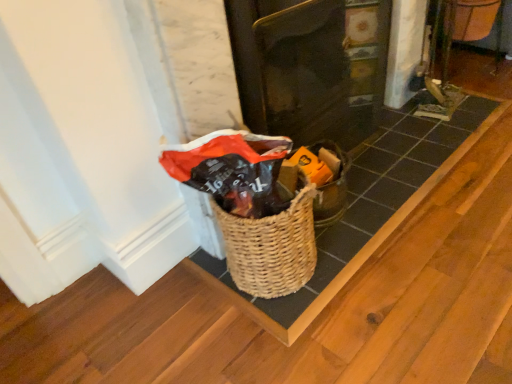
Measure the distance between point (404,190) and camera.

Point (404,190) is 5.34 feet away from camera.

The image size is (512, 384). I want to click on matte black door at center, so click(311, 66).

From the image's perspective, would you say woven brown basket at center is positioned over woven wood basket at center?

No, from the image's perspective, woven brown basket at center is not over woven wood basket at center.

Considering the relative sizes of woven brown basket at center and woven wood basket at center in the image provided, is woven brown basket at center taller than woven wood basket at center?

Correct, woven brown basket at center is much taller as woven wood basket at center.

Is woven brown basket at center facing away from woven wood basket at center?

No, woven brown basket at center is not facing away from woven wood basket at center.

Between woven brown basket at center and woven wood basket at center, which one has larger size?

woven brown basket at center.

From the image's perspective, between woven wood basket at center and woven brown basket at center, who is located below?

woven brown basket at center appears lower in the image.

Which is correct: woven wood basket at center is inside woven brown basket at center, or outside of it?

woven wood basket at center cannot be found inside woven brown basket at center.

Where is `basket lying below the woven wood basket at center (from the image's perspective)`? This screenshot has height=384, width=512. basket lying below the woven wood basket at center (from the image's perspective) is located at coordinates (272, 246).

From the picture: Which object is positioned more to the left, woven wood basket at center or woven brown basket at center?

From the viewer's perspective, woven brown basket at center appears more on the left side.

Does matte black door at center have a greater width compared to woven wood basket at center?

No.

Does point (360, 25) appear closer or farther from the camera than point (224, 283)?

Point (360, 25).

How many degrees apart are the facing directions of matte black door at center and woven wood basket at center?

The facing directions of matte black door at center and woven wood basket at center are 0.00194 degrees apart.

Which object is more forward, matte black door at center or woven wood basket at center?

matte black door at center is more forward.

At what (x,y) coordinates should I click in order to perform the action: click on basket located in front of the matte black door at center. Please return your answer as a coordinate pair (x, y). Looking at the image, I should click on (272, 246).

Can you confirm if matte black door at center is bigger than woven brown basket at center?

Yes, matte black door at center is bigger than woven brown basket at center.

Based on the photo, from the image's perspective, is matte black door at center above or below woven brown basket at center?

Clearly, from the image's perspective, matte black door at center is above woven brown basket at center.

Is point (330, 228) positioned after point (330, 113)?

No.

Is woven wood basket at center turned away from matte black door at center?

Yes.

You are a GUI agent. You are given a task and a screenshot of the screen. Output one action in this format:
    pyautogui.click(x=<x>, y=<y>)
    Task: Click on the door above the woven wood basket at center (from the image's perspective)
    This screenshot has height=384, width=512.
    Given the screenshot: What is the action you would take?
    pyautogui.click(x=311, y=66)

Which object is closer to the camera, woven wood basket at center or matte black door at center?

matte black door at center.

In the scene shown: From a real-world perspective, relative to matte black door at center, is woven brown basket at center vertically above or below?

woven brown basket at center is below matte black door at center.

The image size is (512, 384). I want to click on basket directly beneath the matte black door at center (from a real-world perspective), so click(272, 246).

Can you confirm if woven brown basket at center is bigger than matte black door at center?

No, woven brown basket at center is not bigger than matte black door at center.

From the image's perspective, relative to matte black door at center, is woven brown basket at center above or below?

From the image's perspective, woven brown basket at center appears below matte black door at center.

I want to click on plank located behind the woven brown basket at center, so click(x=366, y=207).

At what (x,y) coordinates should I click in order to perform the action: click on basket in front of the woven wood basket at center. Please return your answer as a coordinate pair (x, y). Looking at the image, I should click on (272, 246).

Which object lies nearer to the anchor point woven wood basket at center, matte black door at center or woven brown basket at center?

woven brown basket at center lies closer to woven wood basket at center than the other object.

Based on their spatial positions, is woven wood basket at center or matte black door at center closer to woven brown basket at center?

woven wood basket at center is positioned closer to the anchor woven brown basket at center.

Considering their positions, is matte black door at center positioned closer to woven brown basket at center than woven wood basket at center?

woven wood basket at center lies closer to woven brown basket at center than the other object.

Estimate the real-world distances between objects in this image. Which object is closer to matte black door at center, woven wood basket at center or woven brown basket at center?

woven wood basket at center.

In the scene shown: Considering their positions, is woven brown basket at center positioned further to matte black door at center than woven wood basket at center?

woven brown basket at center lies further to matte black door at center than the other object.

Looking at this image, when comparing their distances from woven wood basket at center, does woven brown basket at center or matte black door at center seem closer?

woven brown basket at center is closer to woven wood basket at center.

Locate an element on the screen. plank between matte black door at center and woven brown basket at center from top to bottom is located at coordinates (x=366, y=207).